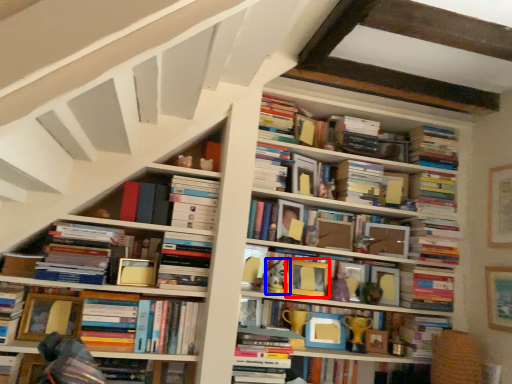
Question: Which object appears closest to the camera in this image, picture frame (highlighted by a red box) or toy (highlighted by a blue box)?

Choices:
 (A) picture frame
 (B) toy

Answer: (B)